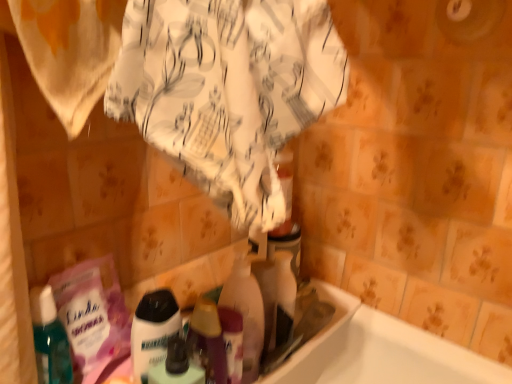
Question: Should I look upward or downward to see translucent plastic bottle at center, the 1th cleaning product positioned from the right?

Choices:
 (A) up
 (B) down

Answer: (B)

Question: Does translucent plastic bottle at center, the 1th cleaning product in the left-to-right sequence, appear on the right side of translucent plastic bottle at center, which is counted as the second cleaning product, starting from the left?

Choices:
 (A) yes
 (B) no

Answer: (B)

Question: Does translucent plastic bottle at center, which is the 3th cleaning product in right-to-left order, have a lesser width compared to translucent plastic bottle at center, arranged as the second cleaning product when viewed from the right?

Choices:
 (A) yes
 (B) no

Answer: (A)

Question: Would you say translucent plastic bottle at center, arranged as the second cleaning product when viewed from the right, is part of translucent plastic bottle at center, which is the 3th cleaning product in right-to-left order,'s contents?

Choices:
 (A) yes
 (B) no

Answer: (B)

Question: Is translucent plastic bottle at center, the 1th cleaning product in the left-to-right sequence, closer to the viewer compared to translucent plastic bottle at center, arranged as the second cleaning product when viewed from the right?

Choices:
 (A) no
 (B) yes

Answer: (B)

Question: From a real-world perspective, is translucent plastic bottle at center, the 1th cleaning product in the left-to-right sequence, located beneath translucent plastic bottle at center, which is counted as the second cleaning product, starting from the left?

Choices:
 (A) yes
 (B) no

Answer: (A)

Question: Is translucent plastic bottle at center, which is the 3th cleaning product in right-to-left order, completely or partially outside of translucent plastic bottle at center, which is counted as the second cleaning product, starting from the left?

Choices:
 (A) no
 (B) yes

Answer: (B)

Question: Considering the relative sizes of translucent plastic bottle at center, the 1th cleaning product in the left-to-right sequence, and translucent plastic bottle at center, the third cleaning product viewed from the left, in the image provided, is translucent plastic bottle at center, the 1th cleaning product in the left-to-right sequence, wider than translucent plastic bottle at center, the third cleaning product viewed from the left,?

Choices:
 (A) no
 (B) yes

Answer: (A)

Question: Is translucent plastic bottle at center, the 1th cleaning product in the left-to-right sequence, shorter than translucent plastic bottle at center, the third cleaning product viewed from the left?

Choices:
 (A) yes
 (B) no

Answer: (B)

Question: From a real-world perspective, is translucent plastic bottle at center, the 1th cleaning product in the left-to-right sequence, below translucent plastic bottle at center, the third cleaning product viewed from the left?

Choices:
 (A) yes
 (B) no

Answer: (B)

Question: Is translucent plastic bottle at center, the 1th cleaning product in the left-to-right sequence, positioned in front of translucent plastic bottle at center, the third cleaning product viewed from the left?

Choices:
 (A) yes
 (B) no

Answer: (A)

Question: Does translucent plastic bottle at center, the 1th cleaning product in the left-to-right sequence, appear on the right side of translucent plastic bottle at center, the 1th cleaning product positioned from the right?

Choices:
 (A) yes
 (B) no

Answer: (B)

Question: Is the surface of translucent plastic bottle at center, the 1th cleaning product in the left-to-right sequence, in direct contact with translucent plastic bottle at center, the 1th cleaning product positioned from the right?

Choices:
 (A) no
 (B) yes

Answer: (A)

Question: Can you confirm if translucent plastic bottle at center, the third cleaning product viewed from the left, is thinner than translucent plastic bottle at center, the 1th cleaning product in the left-to-right sequence?

Choices:
 (A) no
 (B) yes

Answer: (A)